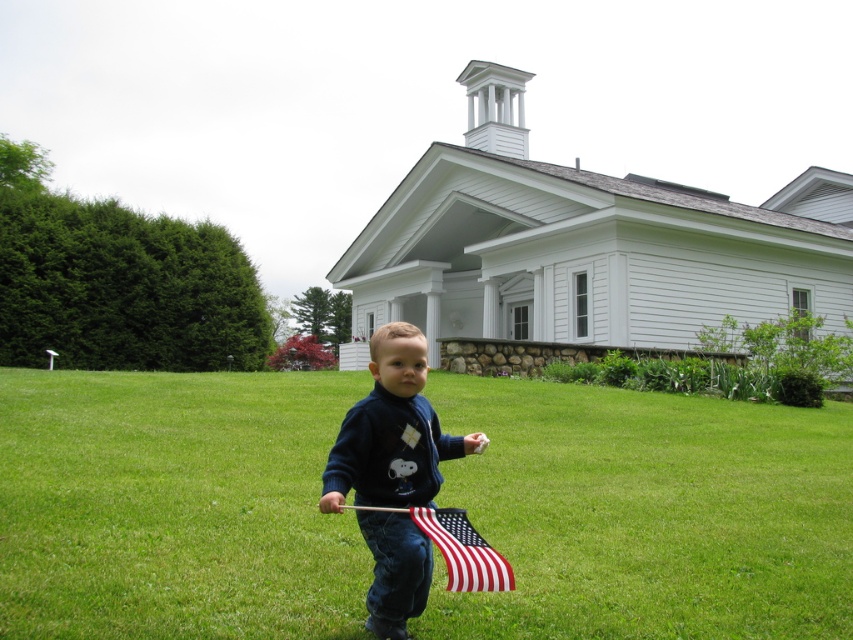
Does dark blue sweater at center appear on the right side of american flag at center?

No, dark blue sweater at center is not to the right of american flag at center.

Between dark blue sweater at center and american flag at center, which one appears on the left side from the viewer's perspective?

dark blue sweater at center is more to the left.

Between point (427, 483) and point (480, 582), which one is positioned behind?

The point (427, 483) is behind.

You are a GUI agent. You are given a task and a screenshot of the screen. Output one action in this format:
    pyautogui.click(x=<x>, y=<y>)
    Task: Click on the dark blue sweater at center
    The height and width of the screenshot is (640, 853).
    Given the screenshot: What is the action you would take?
    pyautogui.click(x=392, y=432)

Is green grass at center above american flag at center?

No.

Does green grass at center have a greater height compared to american flag at center?

Yes.

Identify the location of green grass at center. This screenshot has width=853, height=640. (647, 513).

Identify the location of green grass at center. This screenshot has height=640, width=853. (647, 513).

Who is positioned more to the right, green grass at center or dark blue sweater at center?

green grass at center

Who is shorter, green grass at center or dark blue sweater at center?

With less height is green grass at center.

Does point (164, 586) come closer to viewer compared to point (372, 433)?

No, (164, 586) is behind (372, 433).

You are a GUI agent. You are given a task and a screenshot of the screen. Output one action in this format:
    pyautogui.click(x=<x>, y=<y>)
    Task: Click on the green grass at center
    
    Given the screenshot: What is the action you would take?
    pyautogui.click(x=647, y=513)